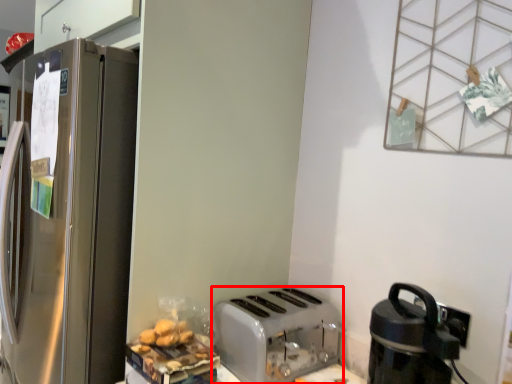
Question: From the image's perspective, where is toaster (annotated by the red box) located in relation to kitchen appliance in the image?

Choices:
 (A) below
 (B) above

Answer: (A)